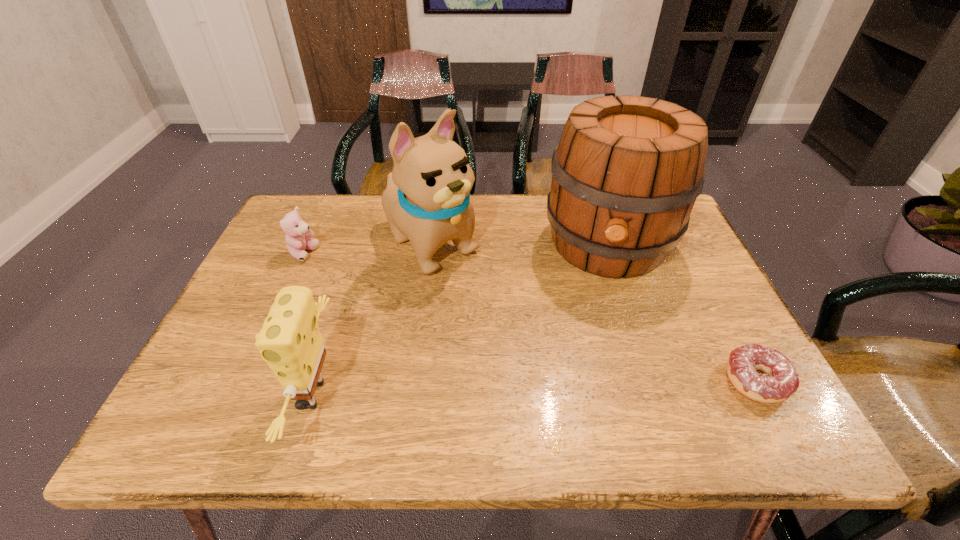
Find the location of a particular element. The height and width of the screenshot is (540, 960). free location located 0.320m on the left of the doughnut is located at coordinates (x=566, y=381).

This screenshot has width=960, height=540. In order to click on vacant space located at the face of the leftmost object in this screenshot , I will do `click(370, 295)`.

Find the location of a particular element. Image resolution: width=960 pixels, height=540 pixels. vacant space situated at the face of the leftmost object is located at coordinates (343, 279).

Where is `vacant area situated at the face of the leftmost object`? This screenshot has height=540, width=960. vacant area situated at the face of the leftmost object is located at coordinates (359, 288).

At what (x,y) coordinates should I click in order to perform the action: click on vacant area situated 0.130m on the side of the cider where the spigot is located. Please return your answer as a coordinate pair (x, y). Looking at the image, I should click on (600, 330).

Identify the location of free space located 0.120m on the side of the cider where the spigot is located. The width and height of the screenshot is (960, 540). (600, 327).

The height and width of the screenshot is (540, 960). What are the coordinates of `vacant space located on the side of the cider where the spigot is located` in the screenshot? It's located at (593, 389).

This screenshot has width=960, height=540. What are the coordinates of `vacant space located 0.150m on the face of the puppy` in the screenshot? It's located at (498, 305).

At what (x,y) coordinates should I click in order to perform the action: click on vacant space situated 0.080m on the face of the puppy. Please return your answer as a coordinate pair (x, y). Image resolution: width=960 pixels, height=540 pixels. Looking at the image, I should click on (480, 288).

Locate an element on the screen. vacant point located 0.310m on the face of the puppy is located at coordinates (546, 346).